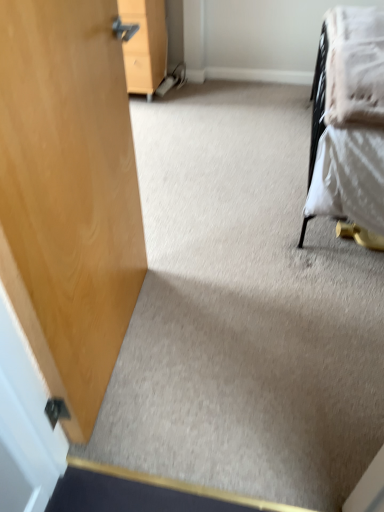
Question: From the image's perspective, would you say wooden cabinet at upper left is positioned over white soft blanket at upper right?

Choices:
 (A) no
 (B) yes

Answer: (B)

Question: Does wooden cabinet at upper left appear on the left side of white soft blanket at upper right?

Choices:
 (A) yes
 (B) no

Answer: (A)

Question: From a real-world perspective, is wooden cabinet at upper left on top of white soft blanket at upper right?

Choices:
 (A) yes
 (B) no

Answer: (B)

Question: Considering the relative sizes of wooden cabinet at upper left and white soft blanket at upper right in the image provided, is wooden cabinet at upper left bigger than white soft blanket at upper right?

Choices:
 (A) yes
 (B) no

Answer: (A)

Question: Is wooden cabinet at upper left thinner than white soft blanket at upper right?

Choices:
 (A) no
 (B) yes

Answer: (A)

Question: Is wooden cabinet at upper left oriented towards white soft blanket at upper right?

Choices:
 (A) yes
 (B) no

Answer: (B)

Question: From a real-world perspective, is white soft blanket at upper right over wooden cabinet at upper left?

Choices:
 (A) no
 (B) yes

Answer: (B)

Question: From a real-world perspective, is white soft blanket at upper right below wooden cabinet at upper left?

Choices:
 (A) no
 (B) yes

Answer: (A)

Question: Would you say white soft blanket at upper right is outside wooden cabinet at upper left?

Choices:
 (A) yes
 (B) no

Answer: (A)

Question: Does white soft blanket at upper right appear on the left side of wooden cabinet at upper left?

Choices:
 (A) no
 (B) yes

Answer: (A)

Question: Considering the relative sizes of white soft blanket at upper right and wooden cabinet at upper left in the image provided, is white soft blanket at upper right thinner than wooden cabinet at upper left?

Choices:
 (A) no
 (B) yes

Answer: (B)

Question: From the image's perspective, is white soft blanket at upper right below wooden cabinet at upper left?

Choices:
 (A) no
 (B) yes

Answer: (B)

Question: In the image, is wooden cabinet at upper left on the left side or the right side of white soft blanket at upper right?

Choices:
 (A) left
 (B) right

Answer: (A)